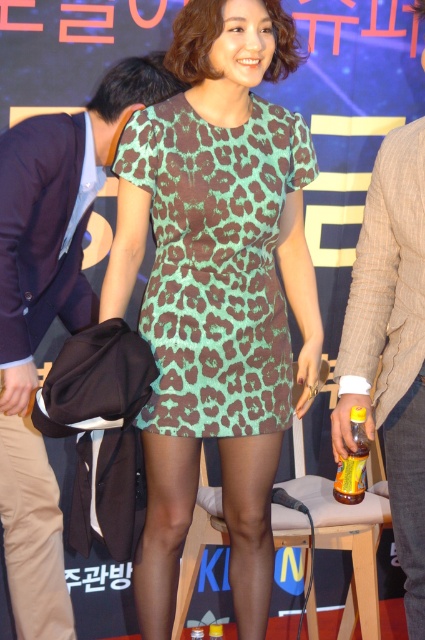
Based on the scene description, where is the black leather pants at lower center located in relation to the yellow glass bottle at lower center?

The black leather pants at lower center are to the right of the yellow glass bottle at lower center.

Based on the scene description, which object is positioned higher on the woman? The green leopard print dress at center or the brown textured blazer at center?

The green leopard print dress at center is positioned higher on the woman than the brown textured blazer at center.